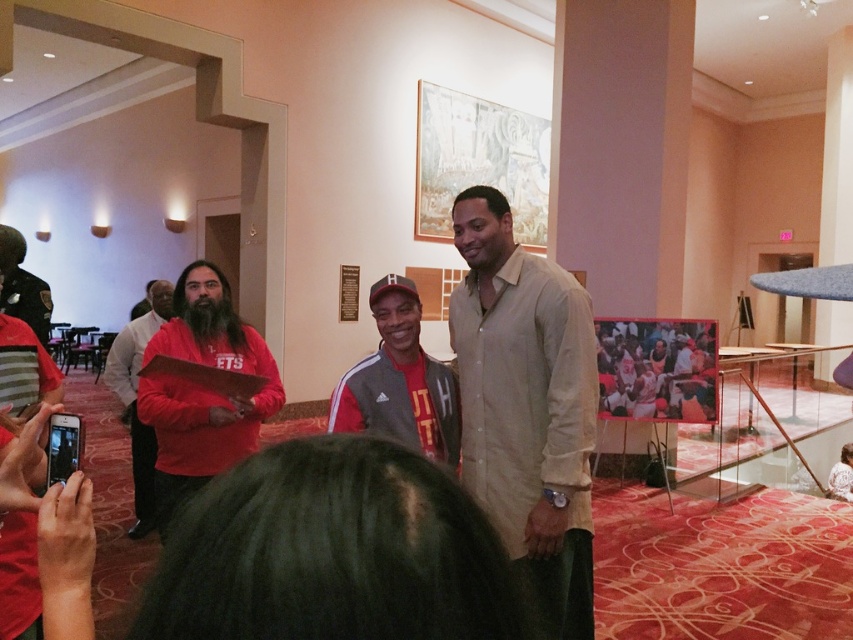
Can you confirm if matte red sweatshirt at center is bigger than red adidas jacket at center?

Yes, matte red sweatshirt at center is bigger than red adidas jacket at center.

Find the location of a particular element. The width and height of the screenshot is (853, 640). matte red sweatshirt at center is located at coordinates (202, 388).

This screenshot has width=853, height=640. Describe the element at coordinates (202, 388) in the screenshot. I see `matte red sweatshirt at center` at that location.

I want to click on matte red sweatshirt at center, so click(202, 388).

Which is more to the left, red adidas jacket at center or red matte jacket at center?

red matte jacket at center

From the picture: Who is more forward, (370,298) or (120,371)?

Point (370,298)

Is point (428, 368) more distant than point (126, 380)?

No.

Locate an element on the screen. The height and width of the screenshot is (640, 853). red adidas jacket at center is located at coordinates (399, 381).

How much distance is there between matte red sweatshirt at center and red matte jacket at center?

The distance of matte red sweatshirt at center from red matte jacket at center is 1.32 meters.

The width and height of the screenshot is (853, 640). What do you see at coordinates (202, 388) in the screenshot?
I see `matte red sweatshirt at center` at bounding box center [202, 388].

Locate an element on the screen. The width and height of the screenshot is (853, 640). matte red sweatshirt at center is located at coordinates (202, 388).